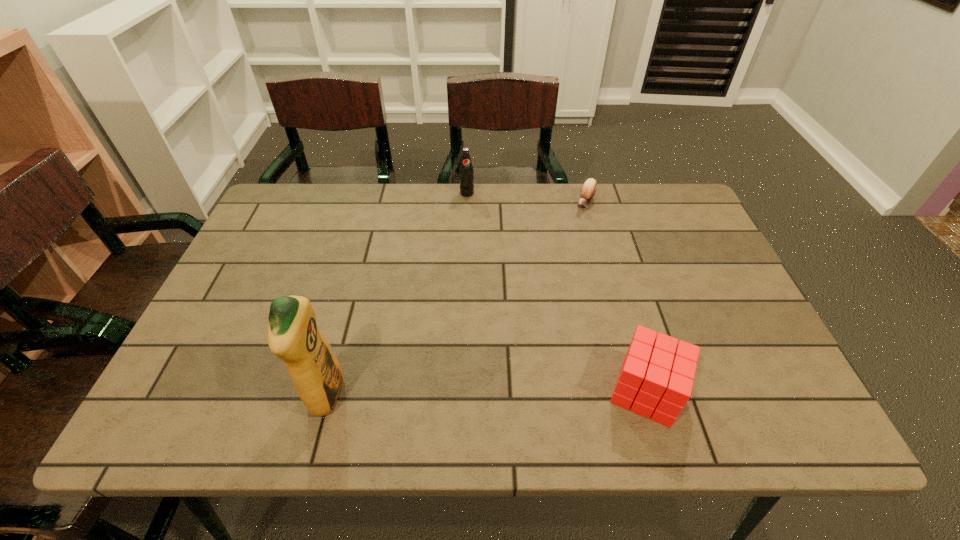
You are a GUI agent. You are given a task and a screenshot of the screen. Output one action in this format:
    pyautogui.click(x=<x>, y=<y>)
    Task: Click on the vacant point located 0.070m on the front label of the pop
    This screenshot has width=960, height=540.
    Given the screenshot: What is the action you would take?
    pyautogui.click(x=471, y=211)

The width and height of the screenshot is (960, 540). Identify the location of vacant region located on the front label of the pop. (489, 275).

Where is `free space located 0.110m on the front label of the pop`? The height and width of the screenshot is (540, 960). free space located 0.110m on the front label of the pop is located at coordinates (474, 219).

This screenshot has height=540, width=960. Identify the location of escargot located at the far edge. (589, 188).

In order to click on pop that is at the far edge in this screenshot , I will do `click(466, 172)`.

This screenshot has width=960, height=540. What are the coordinates of `detergent situated at the near edge` in the screenshot? It's located at (293, 336).

At what (x,y) coordinates should I click in order to perform the action: click on cube that is at the near edge. Please return your answer as a coordinate pair (x, y). Looking at the image, I should click on (656, 377).

Where is `free spot at the far edge of the desktop`? The width and height of the screenshot is (960, 540). free spot at the far edge of the desktop is located at coordinates (506, 184).

In the image, there is a desktop. Where is `free space at the left edge`? This screenshot has width=960, height=540. free space at the left edge is located at coordinates [254, 285].

Where is `vacant space at the right edge of the desktop`? This screenshot has height=540, width=960. vacant space at the right edge of the desktop is located at coordinates [685, 236].